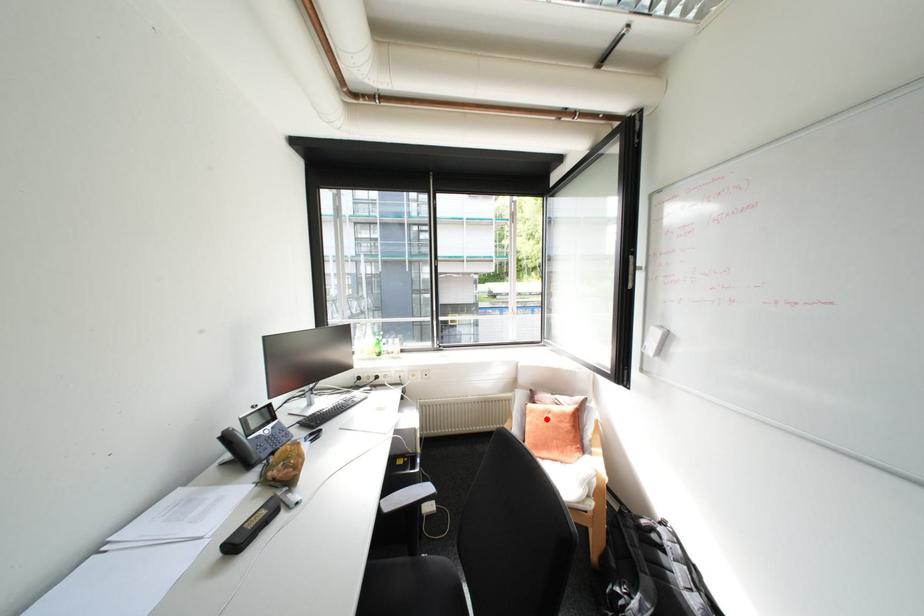
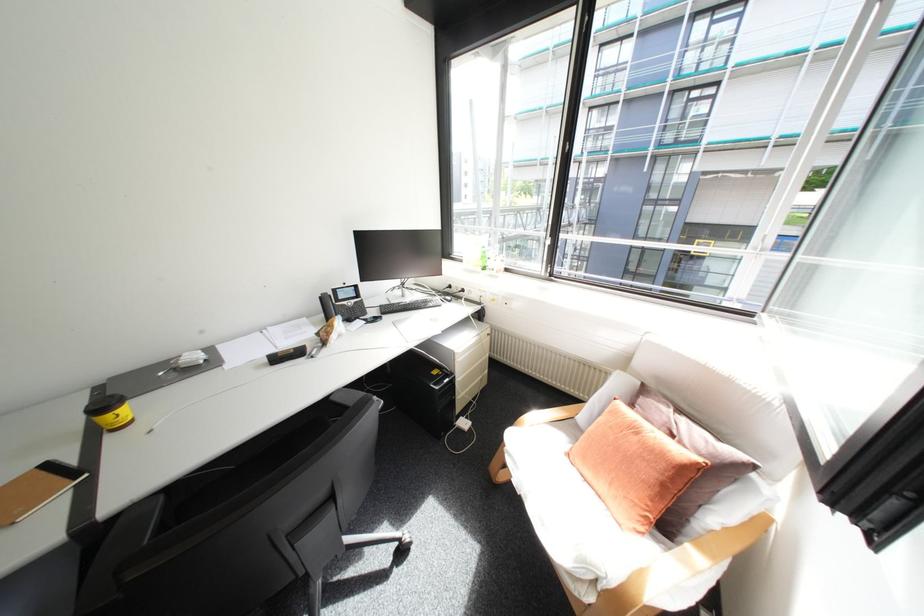
Question: I am providing you with two images of the same scene from different viewpoints. Given a red point in image1, look at the same physical point in image2. Is it:

Choices:
 (A) Closer to the viewpoint
 (B) Farther from the viewpoint

Answer: (A)